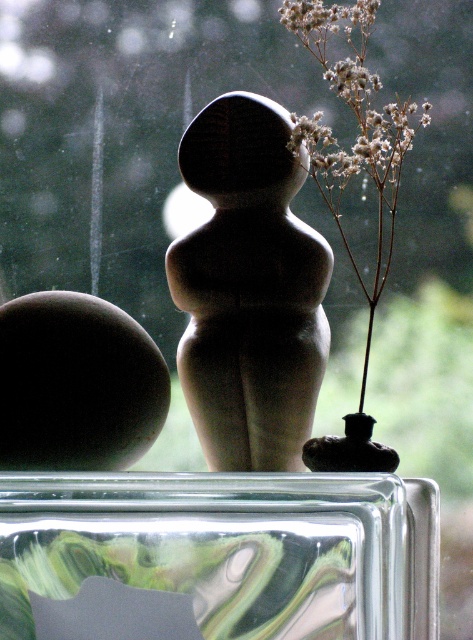
Is marbled glass window sill at center bigger than white fluffy flowers at upper right?

Yes, marbled glass window sill at center is bigger than white fluffy flowers at upper right.

Which of these two, marbled glass window sill at center or white fluffy flowers at upper right, stands shorter?

With less height is marbled glass window sill at center.

Does point (411, 566) come closer to viewer compared to point (317, 35)?

Yes, it is in front of point (317, 35).

Where is `marbled glass window sill at center`? This screenshot has height=640, width=473. marbled glass window sill at center is located at coordinates (218, 556).